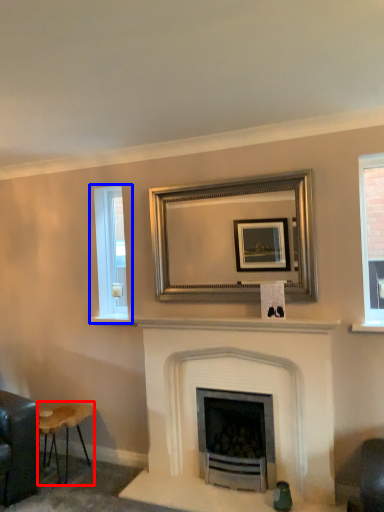
Question: Which object appears closest to the camera in this image, stool (highlighted by a red box) or window (highlighted by a blue box)?

Choices:
 (A) stool
 (B) window

Answer: (A)